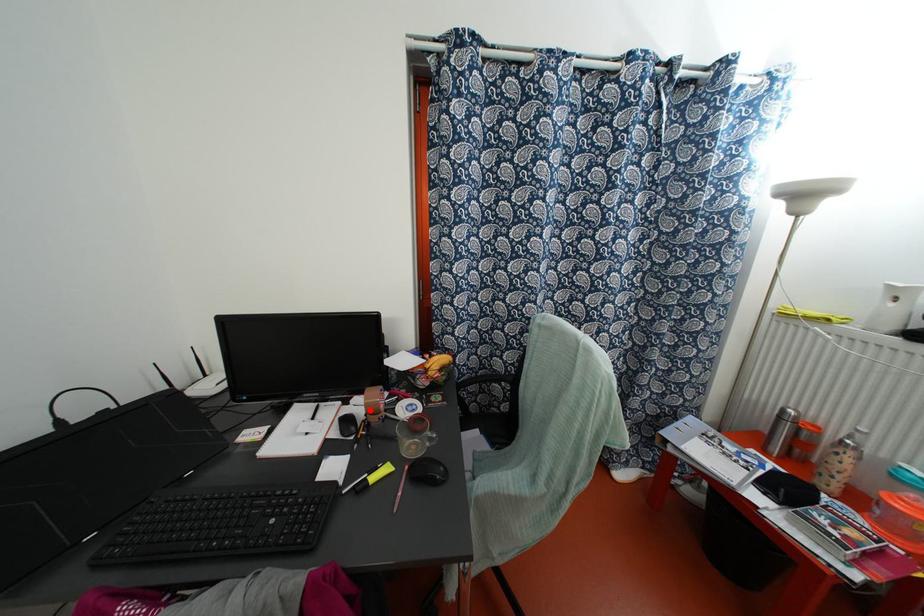
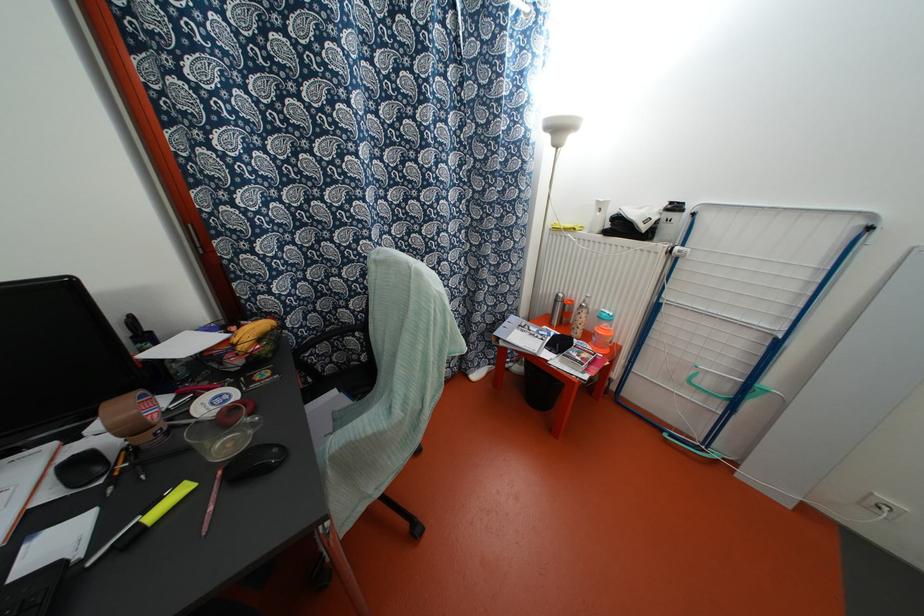
The point at the highlighted location is marked in the first image. Where is the corresponding point in the second image?

(131, 429)